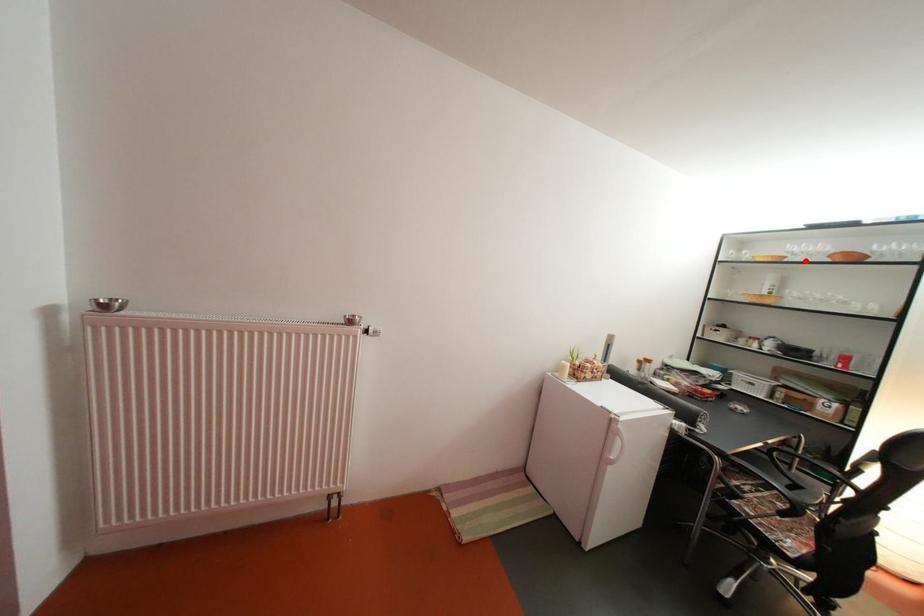
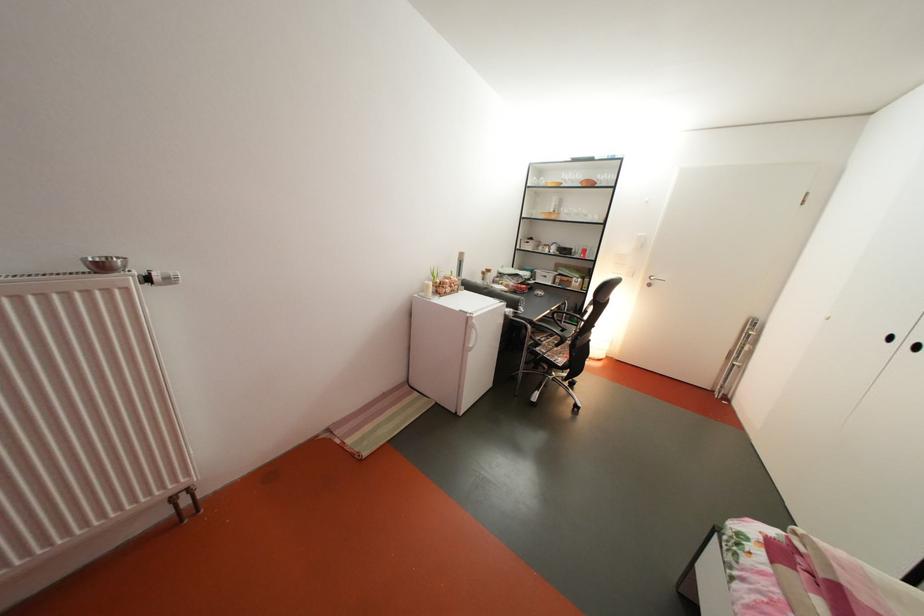
Question: I am providing you with two images of the same scene from different viewpoints. Given a red point in image1, look at the same physical point in image2. Is it:

Choices:
 (A) Closer to the viewpoint
 (B) Farther from the viewpoint

Answer: (A)